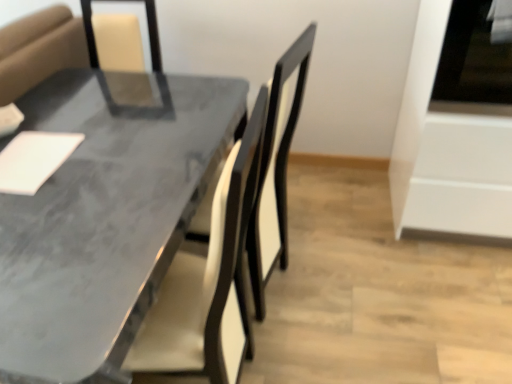
Question: Should I look upward or downward to see marble gray table at center?

Choices:
 (A) down
 (B) up

Answer: (A)

Question: From the image's perspective, does marble gray table at center appear higher than white glossy oven at right?

Choices:
 (A) no
 (B) yes

Answer: (A)

Question: From a real-world perspective, is marble gray table at center over white glossy oven at right?

Choices:
 (A) no
 (B) yes

Answer: (A)

Question: Would you say marble gray table at center is outside white glossy oven at right?

Choices:
 (A) no
 (B) yes

Answer: (B)

Question: Considering the relative positions of marble gray table at center and white glossy oven at right in the image provided, is marble gray table at center to the right of white glossy oven at right from the viewer's perspective?

Choices:
 (A) yes
 (B) no

Answer: (B)

Question: Can you confirm if marble gray table at center is taller than white glossy oven at right?

Choices:
 (A) no
 (B) yes

Answer: (A)

Question: From a real-world perspective, does marble gray table at center sit lower than white glossy oven at right?

Choices:
 (A) yes
 (B) no

Answer: (A)

Question: Can we say white glossy oven at right lies outside marble gray table at center?

Choices:
 (A) yes
 (B) no

Answer: (A)

Question: Is white glossy oven at right taller than marble gray table at center?

Choices:
 (A) no
 (B) yes

Answer: (B)

Question: Can you confirm if white glossy oven at right is positioned to the right of marble gray table at center?

Choices:
 (A) yes
 (B) no

Answer: (A)

Question: Considering the relative sizes of white glossy oven at right and marble gray table at center in the image provided, is white glossy oven at right bigger than marble gray table at center?

Choices:
 (A) yes
 (B) no

Answer: (B)

Question: Is white glossy oven at right closer to the viewer compared to marble gray table at center?

Choices:
 (A) yes
 (B) no

Answer: (B)

Question: Is white glossy oven at right smaller than marble gray table at center?

Choices:
 (A) yes
 (B) no

Answer: (A)

Question: Is marble gray table at center taller or shorter than white glossy oven at right?

Choices:
 (A) short
 (B) tall

Answer: (A)